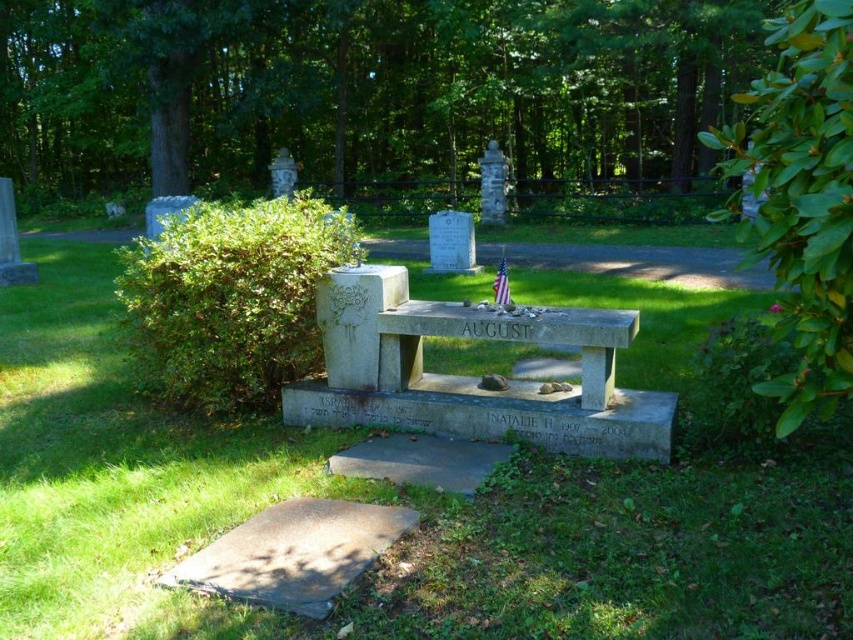
You are standing in the cemetery and want to place a bouquet between the two green leafy bushes. Which direction should you walk from the bench to reach the space between the green leafy bush at left and the green leafy bush at right?

You should walk to the left of the green leafy bush at right to place the bouquet between them since the green leafy bush at left is positioned to the left of the green leafy bush at right.

You are standing at the entrance of the cemetery and want to walk towards the two points marked in the image. Which point, point (x=297, y=51) or point (x=595, y=371), will you reach first?

Point (x=297, y=51) is closer to you than point (x=595, y=371), so you will reach point (x=297, y=51) first.

You are standing in the cemetery and want to place a flower between the green leafy bush at left and the green leafy bush at right. Based on their positions, which bush is closer to the front of the image?

The green leafy bush at left is positioned under the green leafy bush at right, meaning the green leafy bush at left is closer to the front of the image.